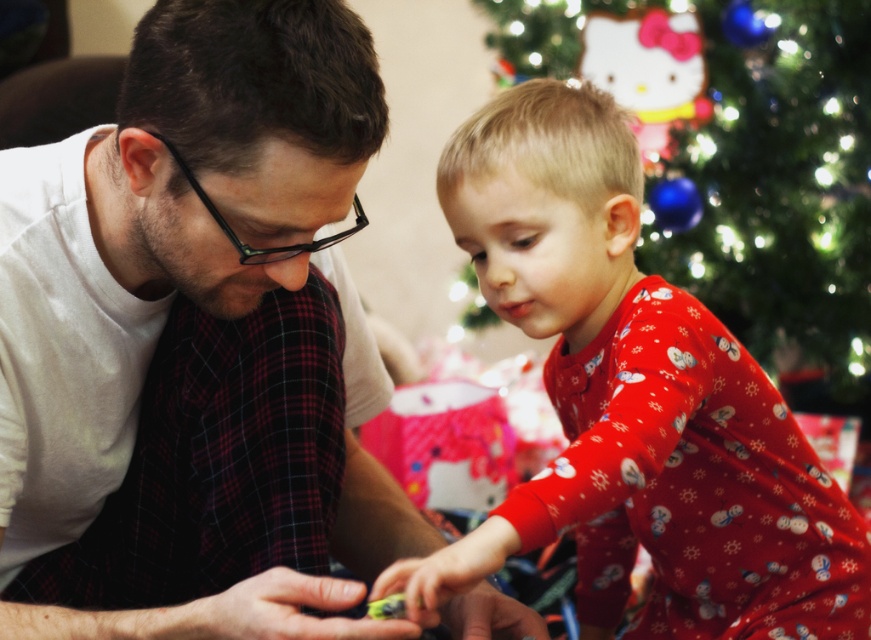
Which is in front, point (321, 630) or point (847, 99)?

Point (321, 630) is more forward.

Is point (390, 481) positioned after point (811, 294)?

No, it is not.

Image resolution: width=871 pixels, height=640 pixels. Find the location of `white matte shirt at center`. white matte shirt at center is located at coordinates (197, 342).

Is red cotton pajamas at center above green matte christmas tree at upper center?

No, red cotton pajamas at center is not above green matte christmas tree at upper center.

Which is in front, point (829, 627) or point (542, 52)?

Point (829, 627) is more forward.

Where is `red cotton pajamas at center`? Image resolution: width=871 pixels, height=640 pixels. red cotton pajamas at center is located at coordinates (633, 403).

Is white matte shirt at center behind red cotton pajamas at center?

That is False.

Identify the location of white matte shirt at center. The height and width of the screenshot is (640, 871). (197, 342).

Where is `white matte shirt at center`? Image resolution: width=871 pixels, height=640 pixels. white matte shirt at center is located at coordinates click(x=197, y=342).